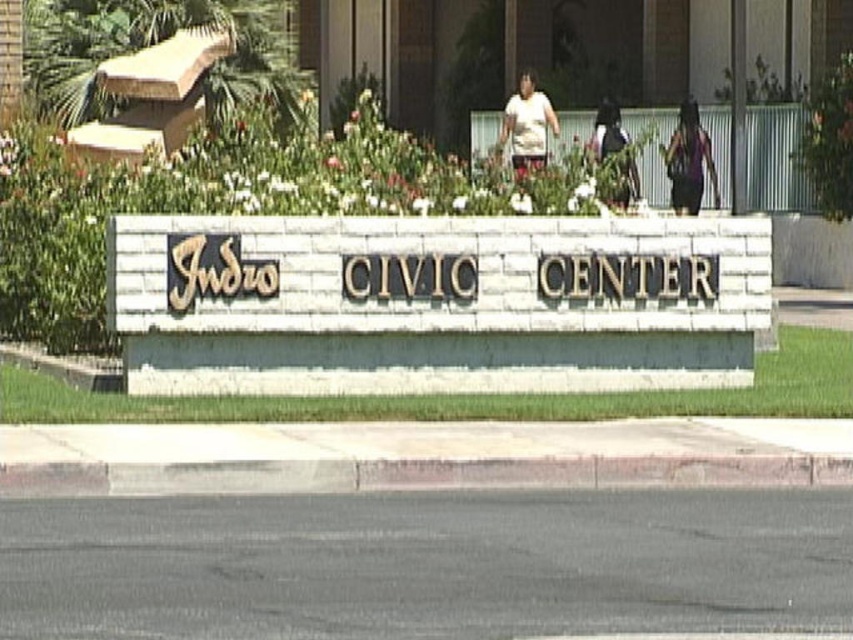
You are a fashion designer observing the Indio Civic Center sign and its surroundings. You notice a dark purple fabric dress at upper right and a white matte shirt at center. Which clothing item is smaller in size?

The dark purple fabric dress at upper right is smaller than the white matte shirt at center.

From the picture: You are standing in front of the Indio Civic Center sign and want to locate the dark purple fabric dress at upper right. According to the coordinates provided, where should you look relative to the sign?

The dark purple fabric dress at upper right is located at coordinates point [689,161] relative to the sign, which means it is positioned to the upper right direction from the sign.

You are a photographer setting up for an event at the Indio Civic Center. You notice a white matte shirt at center and a dark fabric bag at center in your shot. Which object will appear taller in the photo?

The white matte shirt at center has a greater height compared to the dark fabric bag at center, so it will appear taller in the photo.